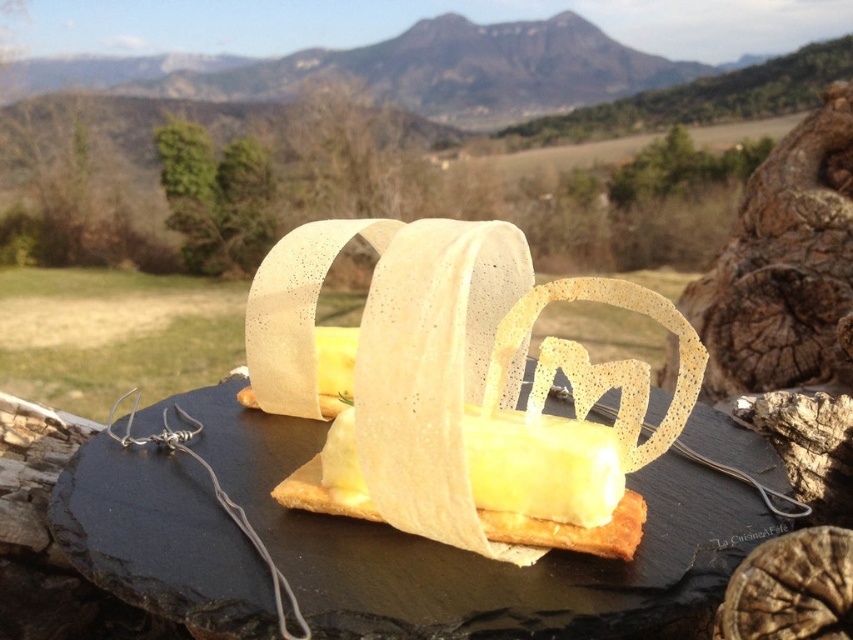
You are a guest at a garden party and see the dessert with the translucent paper crown at center and the rough bark tree trunk at right. Which object is shorter?

The translucent paper crown at center is shorter than the rough bark tree trunk at right.

You are a food critic evaluating the dessert. You notice two points on the plate. One is at coordinates point (x=598, y=513) and the other at point (x=821, y=113). Which point is closer to you?

Point (x=598, y=513) is in front of point (x=821, y=113), so the point at coordinates point (x=598, y=513) is closer to you.